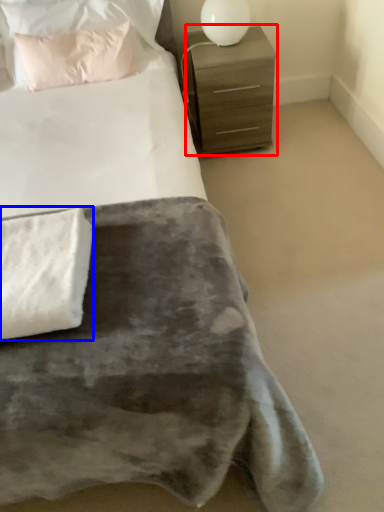
Question: Which of the following is the farthest to the observer, chest of drawers (highlighted by a red box) or blanket (highlighted by a blue box)?

Choices:
 (A) chest of drawers
 (B) blanket

Answer: (A)